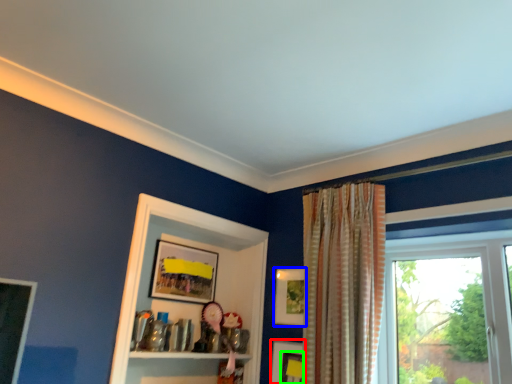
Question: Estimate the real-world distances between objects in this image. Which object is closer to picture frame (highlighted by a red box), picture frame (highlighted by a blue box) or picture frame (highlighted by a green box)?

Choices:
 (A) picture frame
 (B) picture frame

Answer: (B)